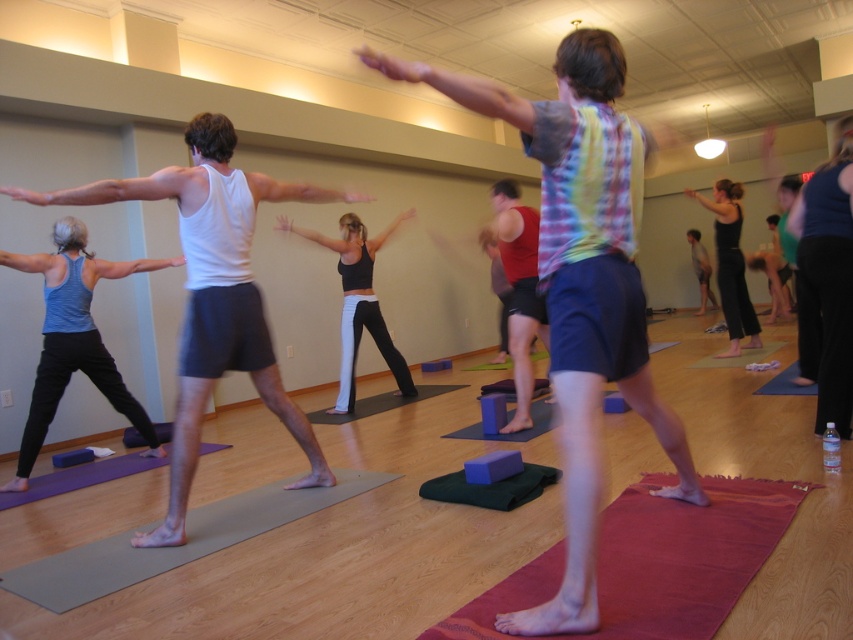
Does red matte yoga block at center have a smaller size compared to black rubber yoga mat at center?

No, red matte yoga block at center is not smaller than black rubber yoga mat at center.

Between point (502, 227) and point (407, 403), which one is positioned in front?

Positioned in front is point (502, 227).

You are a GUI agent. You are given a task and a screenshot of the screen. Output one action in this format:
    pyautogui.click(x=<x>, y=<y>)
    Task: Click on the red matte yoga block at center
    This screenshot has height=640, width=853.
    Given the screenshot: What is the action you would take?
    pyautogui.click(x=518, y=289)

The image size is (853, 640). What do you see at coordinates (683, 554) in the screenshot? I see `red textured yoga mat at lower right` at bounding box center [683, 554].

Does red textured yoga mat at lower right appear on the right side of black fabric yoga pants at center?

Incorrect, red textured yoga mat at lower right is not on the right side of black fabric yoga pants at center.

Does point (641, 480) come in front of point (746, 344)?

Yes, it is.

At what (x,y) coordinates should I click in order to perform the action: click on red textured yoga mat at lower right. Please return your answer as a coordinate pair (x, y). This screenshot has height=640, width=853. Looking at the image, I should click on (683, 554).

Which of these two, red matte yoga block at center or black matte leggings at center, stands taller?

With more height is black matte leggings at center.

Who is positioned more to the left, red matte yoga block at center or black matte leggings at center?

From the viewer's perspective, black matte leggings at center appears more on the left side.

The image size is (853, 640). What do you see at coordinates (518, 289) in the screenshot?
I see `red matte yoga block at center` at bounding box center [518, 289].

In order to click on red matte yoga block at center in this screenshot , I will do `click(518, 289)`.